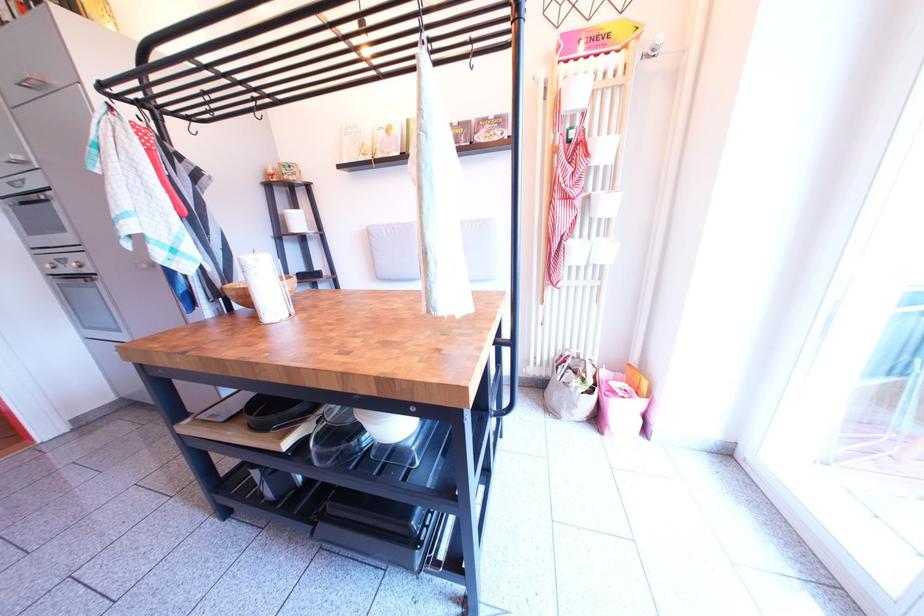
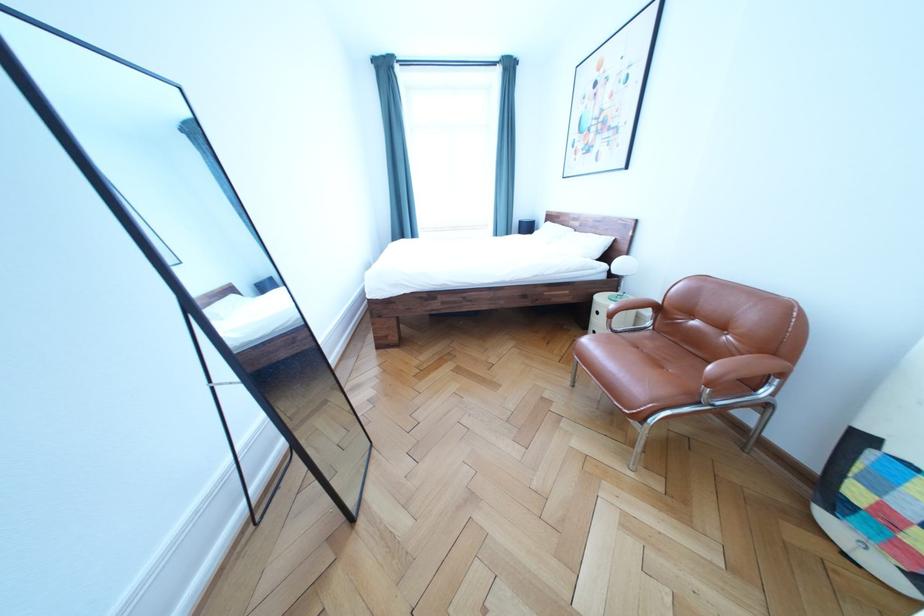
Question: I am providing you with two images of the same scene from different viewpoints. After the viewpoint changes to image2, which objects are now occluded?

Choices:
 (A) black stepladder handle
 (B) white pillow
 (C) pink gift bag
 (D) chair armrest

Answer: (C)